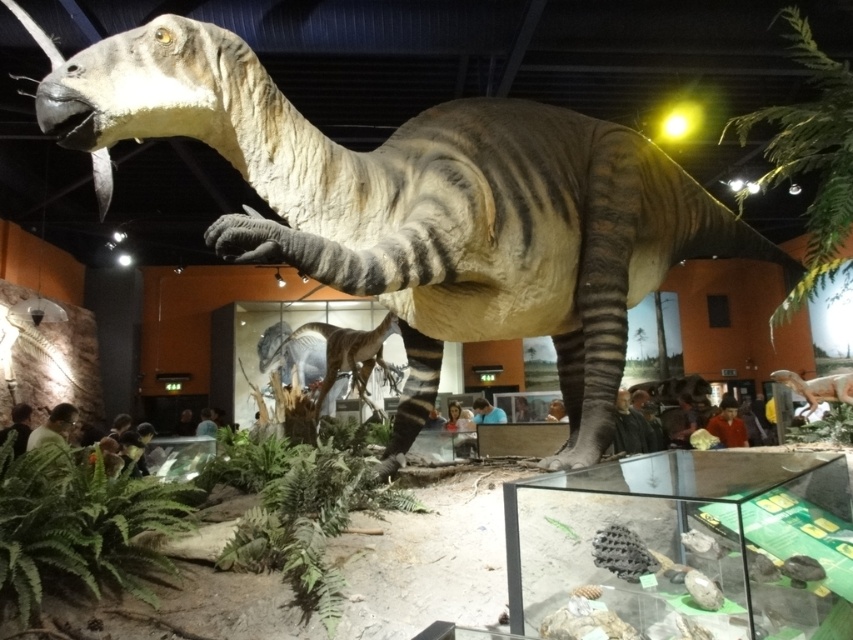
Who is positioned more to the right, matte gray dinosaur at center or smooth brown dinosaur at center?

matte gray dinosaur at center is more to the right.

Is matte gray dinosaur at center above smooth brown dinosaur at center?

Correct, matte gray dinosaur at center is located above smooth brown dinosaur at center.

Who is more distant from viewer, (497, 324) or (285, 339)?

Point (285, 339)

Where is `matte gray dinosaur at center`? matte gray dinosaur at center is located at coordinates (422, 209).